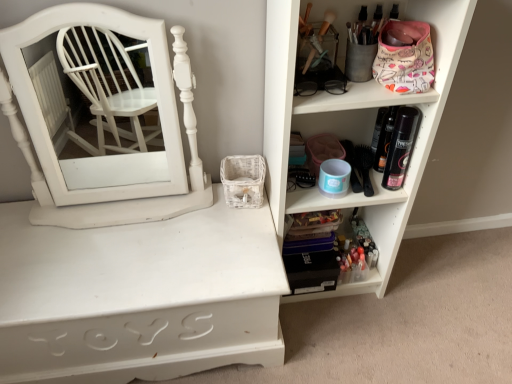
The height and width of the screenshot is (384, 512). What are the coordinates of `vacant space to the right of white wood medicine cabinet at left` in the screenshot? It's located at (219, 232).